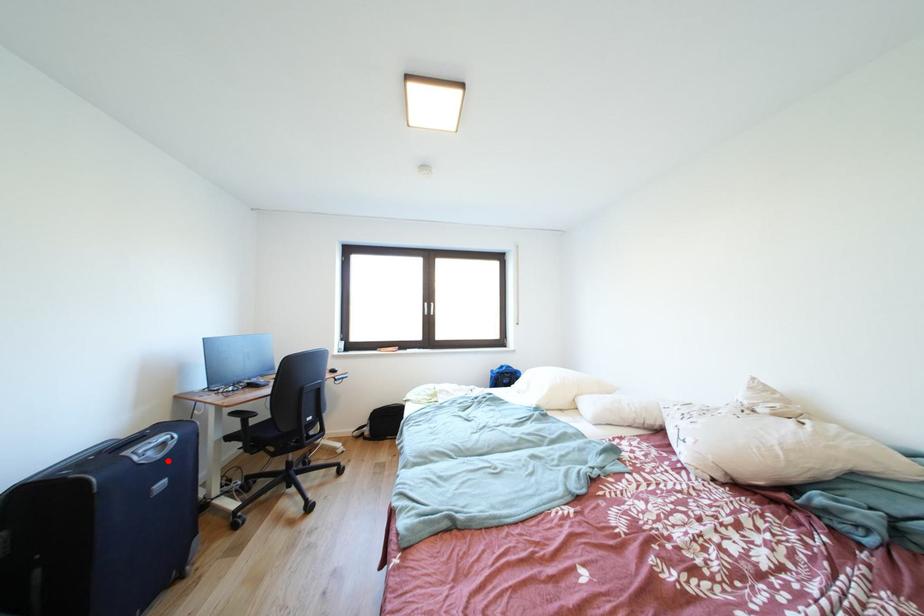
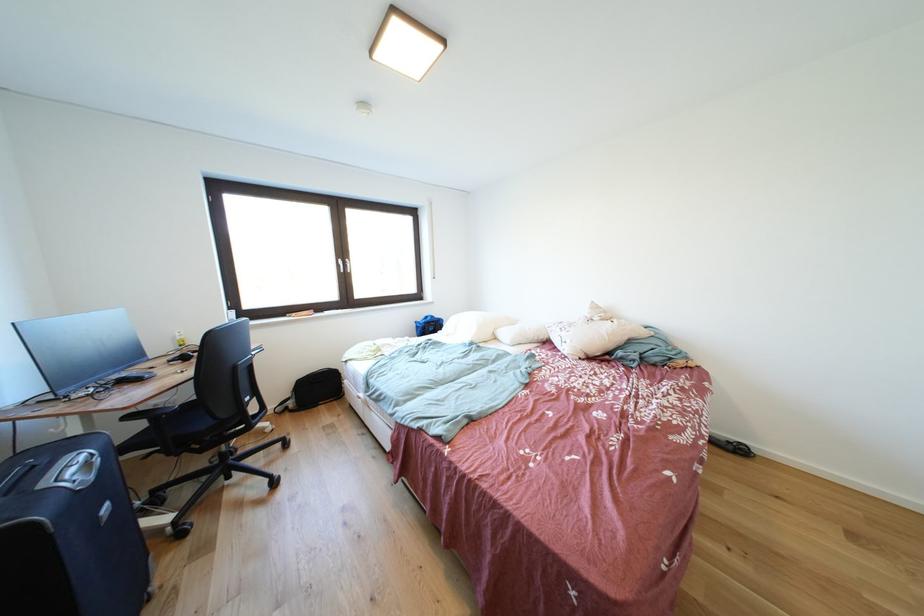
Find the pixel in the second image that matches the highlighted location in the first image.

(101, 483)